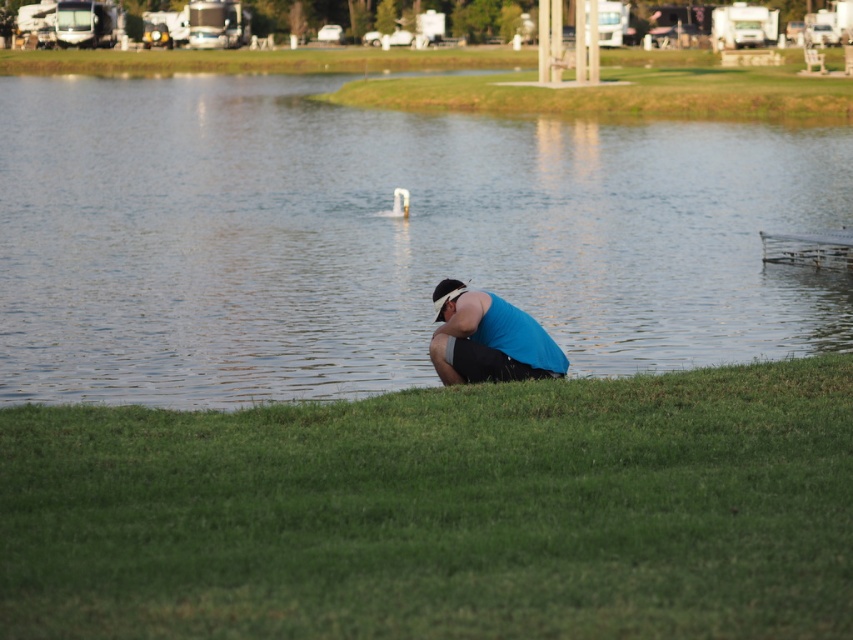
Does green grass at lower center have a greater width compared to blue fabric at center?

Indeed, green grass at lower center has a greater width compared to blue fabric at center.

Which of these two, green grass at lower center or blue fabric at center, stands taller?

blue fabric at center

Identify the location of green grass at lower center. (442, 513).

Where is `green grass at lower center`? Image resolution: width=853 pixels, height=640 pixels. green grass at lower center is located at coordinates (442, 513).

Between clear water at center and blue fabric at center, which one has more height?

With more height is clear water at center.

Measure the distance between point (206,108) and camera.

210.80 feet

In order to click on clear water at center in this screenshot , I will do `click(381, 237)`.

Which is more to the left, clear water at center or green grass at lower center?

green grass at lower center is more to the left.

Between clear water at center and green grass at lower center, which one is positioned higher?

clear water at center is above.

Describe the element at coordinates (381, 237) in the screenshot. I see `clear water at center` at that location.

The height and width of the screenshot is (640, 853). Identify the location of clear water at center. (381, 237).